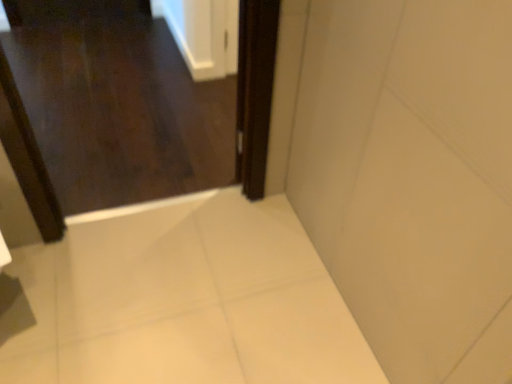
Question: In terms of width, does dark wood door at upper left look wider or thinner when compared to dark wood screen door at center?

Choices:
 (A) wide
 (B) thin

Answer: (A)

Question: From the image's perspective, is dark wood door at upper left above or below dark wood screen door at center?

Choices:
 (A) above
 (B) below

Answer: (A)

Question: Is dark wood door at upper left bigger or smaller than dark wood screen door at center?

Choices:
 (A) small
 (B) big

Answer: (B)

Question: Is dark wood screen door at center inside the boundaries of dark wood door at upper left, or outside?

Choices:
 (A) inside
 (B) outside

Answer: (B)

Question: Is point (262, 173) closer or farther from the camera than point (60, 147)?

Choices:
 (A) farther
 (B) closer

Answer: (B)

Question: Is dark wood screen door at center wider or thinner than dark wood door at upper left?

Choices:
 (A) wide
 (B) thin

Answer: (B)

Question: Is dark wood screen door at center taller or shorter than dark wood door at upper left?

Choices:
 (A) short
 (B) tall

Answer: (B)